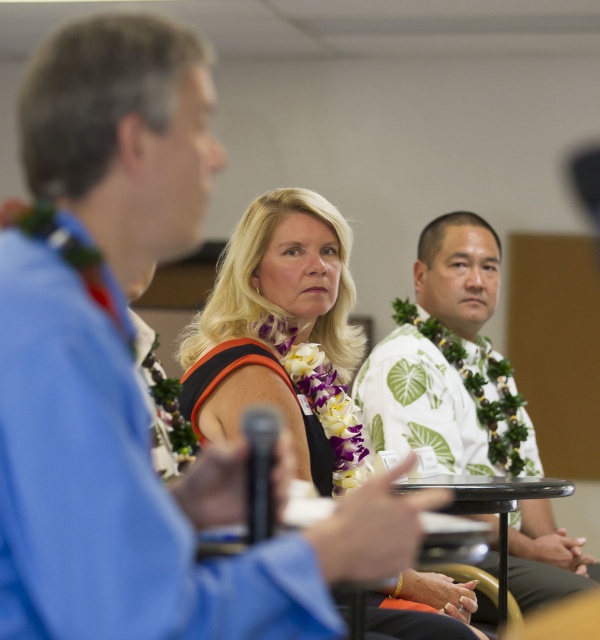
What are the coordinates of the black satin dress at center?

The black satin dress at center is located at coordinates point (280, 333).

You are standing at the origin of the coordinate system in the image. You want to move towards the point with coordinates point (318, 336) and point (541, 486). Which point will you reach first?

Since point (318, 336) is behind point (541, 486), you will reach point (541, 486) first.